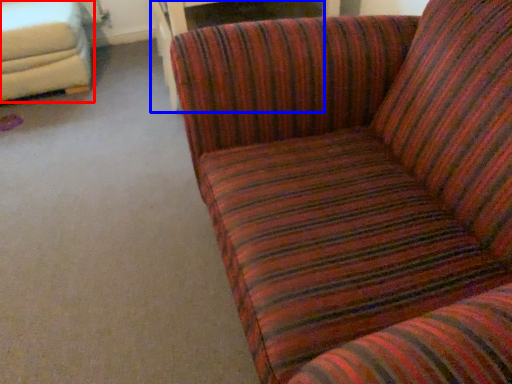
Question: Which of the following is the farthest to the observer, studio couch (highlighted by a red box) or table (highlighted by a blue box)?

Choices:
 (A) studio couch
 (B) table

Answer: (A)